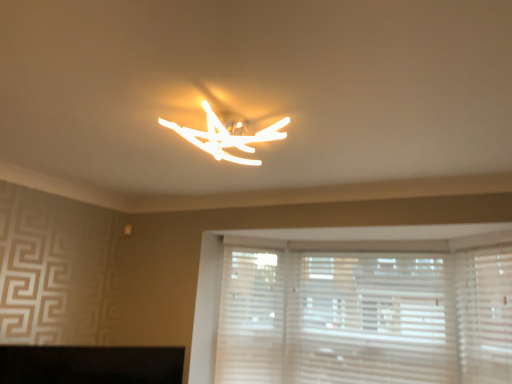
Question: In the image, is white textured blinds at lower right on the left side or the right side of matte white light fixture at center?

Choices:
 (A) left
 (B) right

Answer: (B)

Question: From the image's perspective, is white textured blinds at lower right above or below matte white light fixture at center?

Choices:
 (A) above
 (B) below

Answer: (B)

Question: Which object is the closest to the white matte shutter at lower center, arranged as the first shutter when viewed from the left?

Choices:
 (A) white matte shutter at right, the 2th shutter from the left
 (B) white textured blinds at lower right
 (C) matte white light fixture at center

Answer: (B)

Question: Considering the real-world distances, which object is closest to the matte white light fixture at center?

Choices:
 (A) white matte shutter at lower center, positioned as the second shutter in front-to-back order
 (B) white matte shutter at right, which is counted as the 2th shutter, starting from the back
 (C) white textured blinds at lower right

Answer: (A)